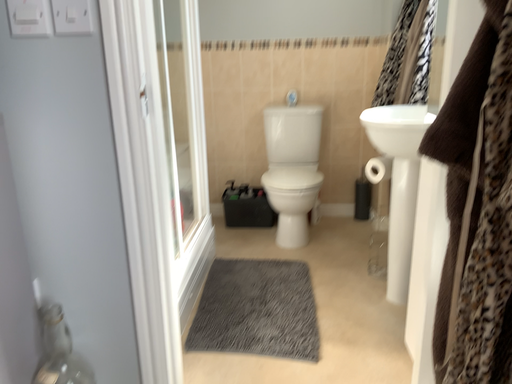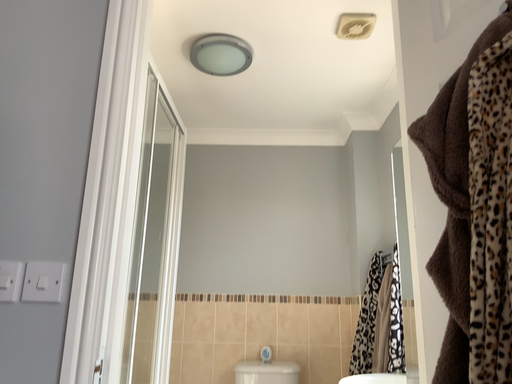
Question: Which way did the camera rotate in the video?

Choices:
 (A) rotated upward
 (B) rotated downward

Answer: (A)